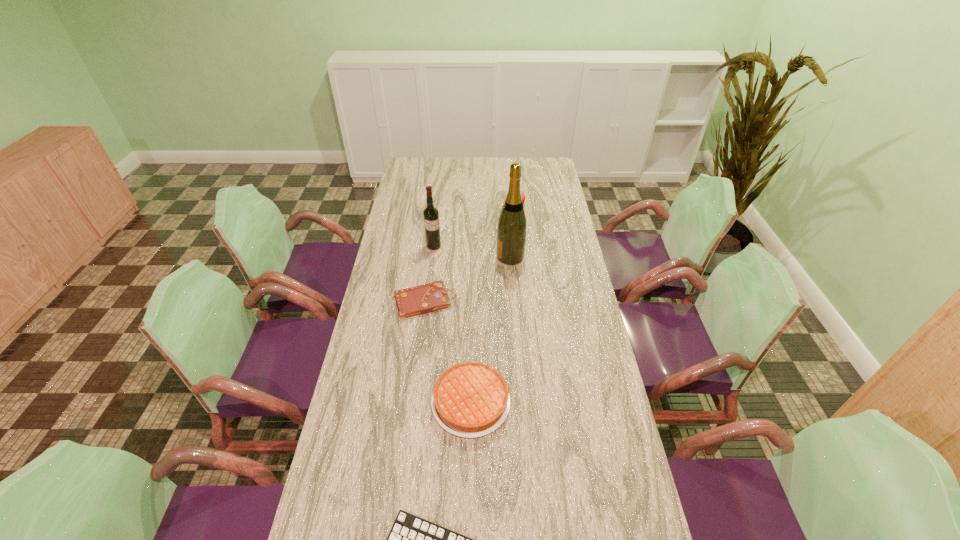
This screenshot has width=960, height=540. Find the location of `vacant space located on the front-facing side of the right wine bottle`. vacant space located on the front-facing side of the right wine bottle is located at coordinates (413, 256).

The height and width of the screenshot is (540, 960). I want to click on free space located 0.220m on the front-facing side of the right wine bottle, so click(x=443, y=256).

At what (x,y) coordinates should I click in order to perform the action: click on free space located on the front and back of the shorter wine bottle. Please return your answer as a coordinate pair (x, y). Looking at the image, I should click on pos(425,320).

Image resolution: width=960 pixels, height=540 pixels. In order to click on vacant area situated 0.110m on the front of the apple in this screenshot , I will do pos(517,224).

Identify the location of blank space located on the back of the fifth farthest object. (472, 290).

Find the location of `vacant space located on the back of the notebook`. vacant space located on the back of the notebook is located at coordinates (433, 238).

Where is `object that is at the left edge`? This screenshot has height=540, width=960. object that is at the left edge is located at coordinates (426, 298).

The height and width of the screenshot is (540, 960). I want to click on blank space at the far edge of the desktop, so click(x=477, y=177).

At what (x,y) coordinates should I click in order to perform the action: click on free space at the left edge of the desktop. Please return your answer as a coordinate pair (x, y). The height and width of the screenshot is (540, 960). Looking at the image, I should click on (365, 401).

You are a GUI agent. You are given a task and a screenshot of the screen. Output one action in this format:
    pyautogui.click(x=<x>, y=<y>)
    Task: Click on the free space at the right edge of the desktop
    This screenshot has width=960, height=540.
    Given the screenshot: What is the action you would take?
    pyautogui.click(x=574, y=277)